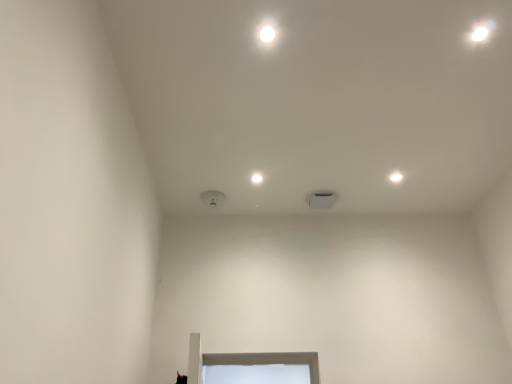
Question: Can you confirm if white matte light fixture at upper right, the 2th dot positioned from the left, is wider than white matte square at center, the 1th dot from the left?

Choices:
 (A) yes
 (B) no

Answer: (B)

Question: Could you tell me if white matte light fixture at upper right, the 2th dot positioned from the left, is turned towards white matte square at center, the 1th dot from the left?

Choices:
 (A) no
 (B) yes

Answer: (B)

Question: Does white matte light fixture at upper right, the 1th dot viewed from the right, contain white matte square at center, the 1th dot from the left?

Choices:
 (A) no
 (B) yes

Answer: (A)

Question: From a real-world perspective, is white matte light fixture at upper right, the 1th dot viewed from the right, below white matte square at center, the 1th dot from the left?

Choices:
 (A) yes
 (B) no

Answer: (A)

Question: Is white matte light fixture at upper right, the 1th dot viewed from the right, positioned with its back to white matte square at center, the 1th dot from the left?

Choices:
 (A) yes
 (B) no

Answer: (B)

Question: Is white matte light fixture at upper right, the 2th dot positioned from the left, next to white matte square at center, the 1th dot from the left?

Choices:
 (A) no
 (B) yes

Answer: (A)

Question: Does white matte square at center, the 1th dot from the left, have a greater height compared to white matte light fixture at upper right, the 1th dot viewed from the right?

Choices:
 (A) yes
 (B) no

Answer: (A)

Question: Considering the relative positions of white matte square at center, the 2th dot in the right-to-left sequence, and white matte light fixture at upper right, the 1th dot viewed from the right, in the image provided, is white matte square at center, the 2th dot in the right-to-left sequence, to the left of white matte light fixture at upper right, the 1th dot viewed from the right, from the viewer's perspective?

Choices:
 (A) no
 (B) yes

Answer: (B)

Question: Is white matte square at center, the 1th dot from the left, bigger than white matte light fixture at upper right, the 2th dot positioned from the left?

Choices:
 (A) no
 (B) yes

Answer: (B)

Question: From a real-world perspective, is white matte square at center, the 1th dot from the left, located higher than white matte light fixture at upper right, the 1th dot viewed from the right?

Choices:
 (A) yes
 (B) no

Answer: (A)

Question: Is white matte square at center, the 1th dot from the left, touching white matte light fixture at upper right, the 1th dot viewed from the right?

Choices:
 (A) yes
 (B) no

Answer: (B)

Question: Does white matte square at center, the 2th dot in the right-to-left sequence, have a lesser height compared to white matte light fixture at upper right, the 1th dot viewed from the right?

Choices:
 (A) yes
 (B) no

Answer: (B)

Question: From a real-world perspective, is white matte light fixture at upper right, the 1th dot viewed from the right, positioned above or below white matte square at center, the 1th dot from the left?

Choices:
 (A) above
 (B) below

Answer: (B)